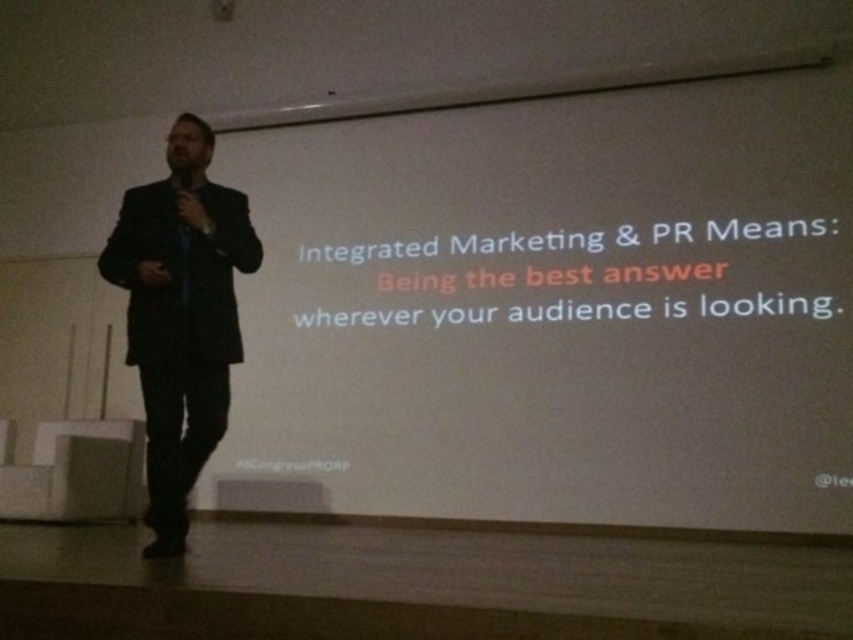
Question: Observing the image, what is the correct spatial positioning of dark suit at left in reference to black matte microphone at left?

Choices:
 (A) above
 (B) below

Answer: (B)

Question: Which point is closer to the camera?

Choices:
 (A) (177, 172)
 (B) (216, 420)

Answer: (B)

Question: Is dark suit at left bigger than black matte microphone at left?

Choices:
 (A) no
 (B) yes

Answer: (B)

Question: Does dark suit at left come behind black matte microphone at left?

Choices:
 (A) no
 (B) yes

Answer: (A)

Question: Which point is farther from the camera taking this photo?

Choices:
 (A) (170, 353)
 (B) (187, 192)

Answer: (B)